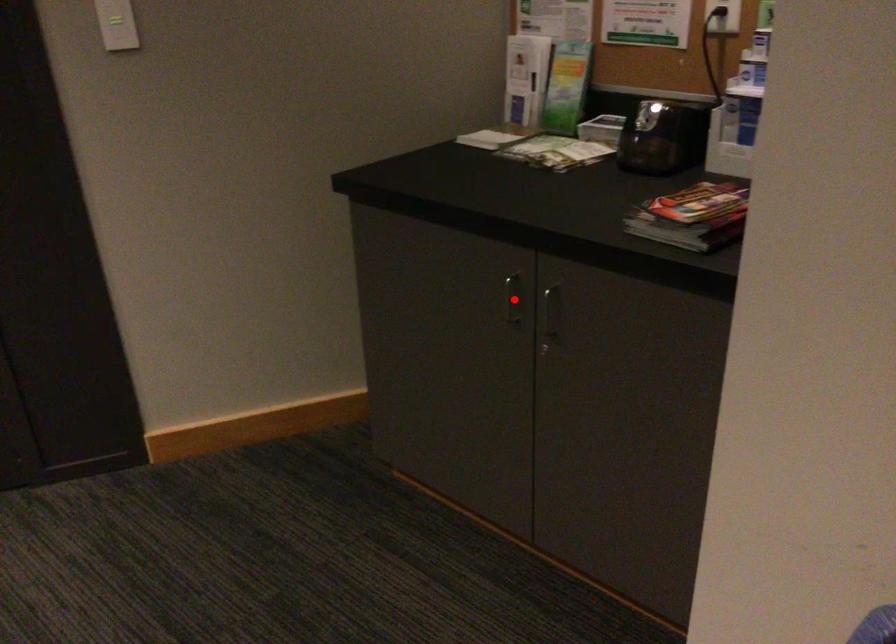
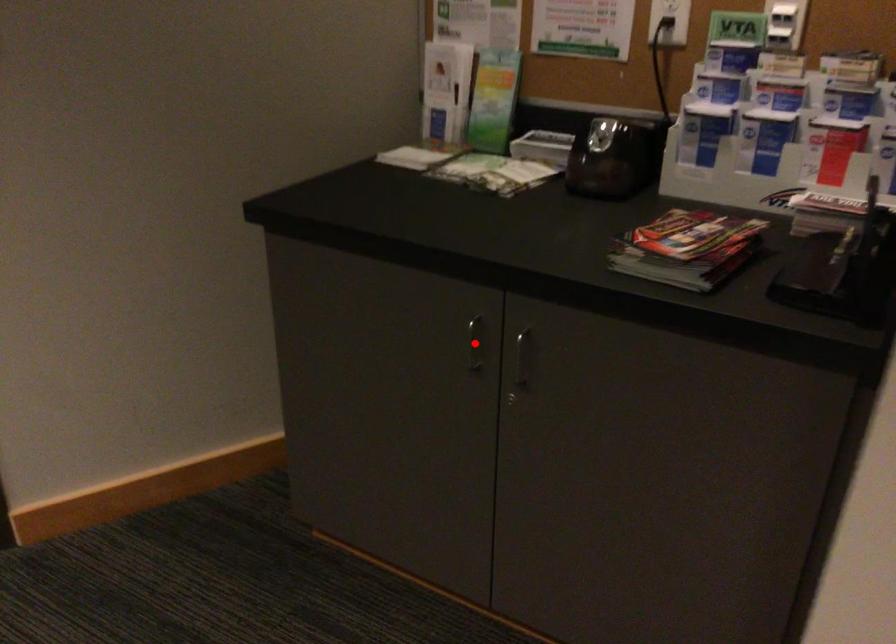
I am providing you with two images of the same scene from different viewpoints. A red point is marked on the first image and another point is marked on the second image. Is the marked point in image1 the same physical position as the marked point in image2?

Yes